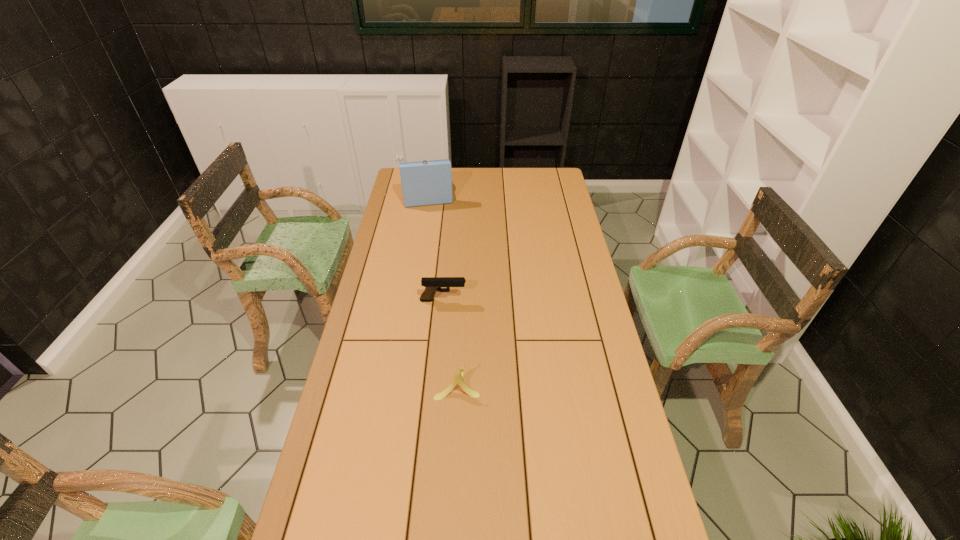
Where is `the tallest object`? The height and width of the screenshot is (540, 960). the tallest object is located at coordinates (424, 183).

Find the location of a particular element. Image resolution: width=960 pixels, height=540 pixels. the farthest object is located at coordinates (424, 183).

Where is `the second farthest object`? the second farthest object is located at coordinates (432, 284).

Identify the location of banana. (458, 376).

Identify the location of free space located on the front of the tallest object. The image size is (960, 540). (418, 247).

Locate an element on the screen. This screenshot has height=540, width=960. vacant space located on the front-facing side of the second farthest object is located at coordinates (517, 300).

Where is `free space located on the left of the banana`? free space located on the left of the banana is located at coordinates (371, 384).

Identify the location of object located in the far edge section of the desktop. The width and height of the screenshot is (960, 540). (424, 183).

You are a GUI agent. You are given a task and a screenshot of the screen. Output one action in this format:
    pyautogui.click(x=<x>, y=<y>)
    Task: Click on the object that is positioned at the left edge
    The height and width of the screenshot is (540, 960).
    Given the screenshot: What is the action you would take?
    pyautogui.click(x=424, y=183)

Where is `object present at the far left corner`? Image resolution: width=960 pixels, height=540 pixels. object present at the far left corner is located at coordinates (424, 183).